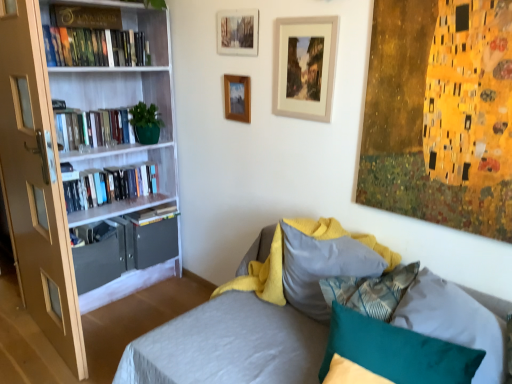
Question: From the image's perspective, is textured gray couch at center beneath textured gray pillow at center, which is the 1th pillow from back to front?

Choices:
 (A) no
 (B) yes

Answer: (B)

Question: Considering the relative sizes of textured gray couch at center and textured gray pillow at center, which is the 1th pillow from back to front, in the image provided, is textured gray couch at center bigger than textured gray pillow at center, which is the 1th pillow from back to front,?

Choices:
 (A) yes
 (B) no

Answer: (A)

Question: From a real-world perspective, is textured gray couch at center under textured gray pillow at center, which appears as the second pillow when viewed from the front?

Choices:
 (A) no
 (B) yes

Answer: (B)

Question: Can you confirm if textured gray couch at center is taller than textured gray pillow at center, which is the 1th pillow from back to front?

Choices:
 (A) yes
 (B) no

Answer: (A)

Question: Is textured gray couch at center facing away from textured gray pillow at center, which is the 1th pillow from back to front?

Choices:
 (A) no
 (B) yes

Answer: (B)

Question: Is textured gray couch at center positioned beyond the bounds of textured gray pillow at center, which is the 1th pillow from back to front?

Choices:
 (A) yes
 (B) no

Answer: (A)

Question: Is hardcover books at left, which is the fourth book in top-to-bottom order, bigger than matte gray drawer at lower left?

Choices:
 (A) yes
 (B) no

Answer: (B)

Question: Is hardcover books at left, which is the fourth book in top-to-bottom order, not within matte gray drawer at lower left?

Choices:
 (A) no
 (B) yes

Answer: (B)

Question: Is the position of hardcover books at left, which is counted as the 2th book, starting from the bottom, less distant than that of matte gray drawer at lower left?

Choices:
 (A) no
 (B) yes

Answer: (A)

Question: Is hardcover books at left, which is counted as the 2th book, starting from the bottom, facing away from matte gray drawer at lower left?

Choices:
 (A) yes
 (B) no

Answer: (B)

Question: Can you confirm if hardcover books at left, which is the fourth book in top-to-bottom order, is taller than matte gray drawer at lower left?

Choices:
 (A) no
 (B) yes

Answer: (A)

Question: Considering the relative positions of hardcover books at left, which is counted as the 2th book, starting from the bottom, and matte gray drawer at lower left in the image provided, is hardcover books at left, which is counted as the 2th book, starting from the bottom, to the left of matte gray drawer at lower left from the viewer's perspective?

Choices:
 (A) yes
 (B) no

Answer: (B)

Question: Is hardcover book at left, which appears as the 2th book when viewed from the top, placed right next to hardcover books at left, which is counted as the 2th book, starting from the bottom?

Choices:
 (A) no
 (B) yes

Answer: (A)